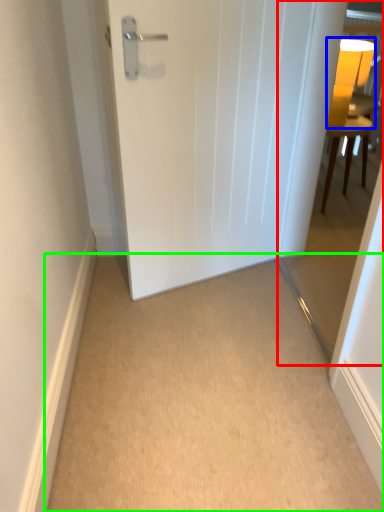
Question: Based on their relative distances, which object is farther from glass door (highlighted by a red box)? Choose from table lamp (highlighted by a blue box) and corridor (highlighted by a green box).

Choices:
 (A) table lamp
 (B) corridor

Answer: (B)